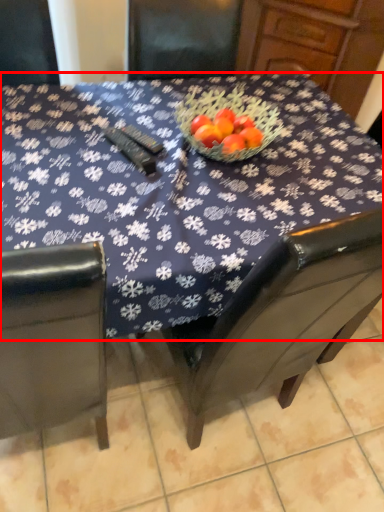
Question: From the image's perspective, what is the correct spatial positioning of table (annotated by the red box) in reference to tile?

Choices:
 (A) below
 (B) above

Answer: (B)